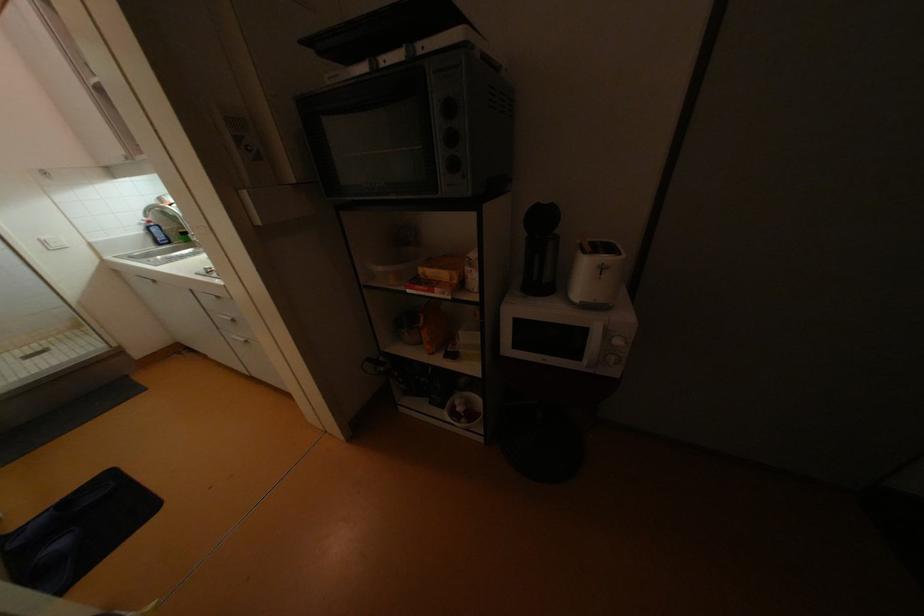
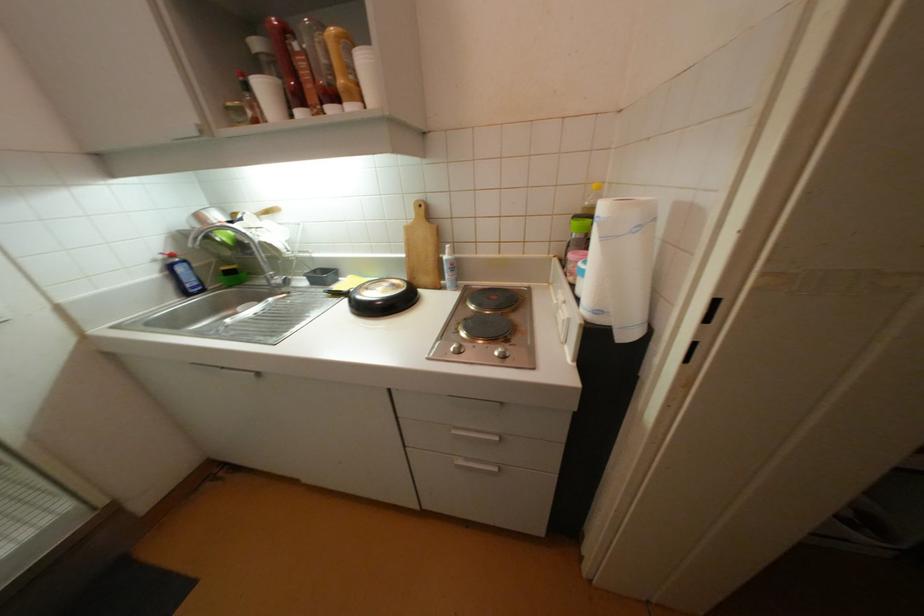
What movement of the cameraman would produce the second image?

The cameraman moved toward left, forward.